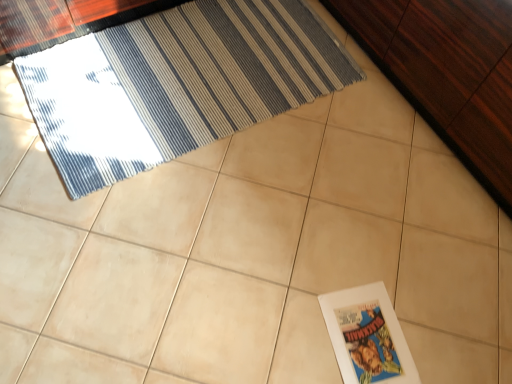
Image resolution: width=512 pixels, height=384 pixels. Find the location of `free location to the right of blue striped rug at upper left`. free location to the right of blue striped rug at upper left is located at coordinates (332, 140).